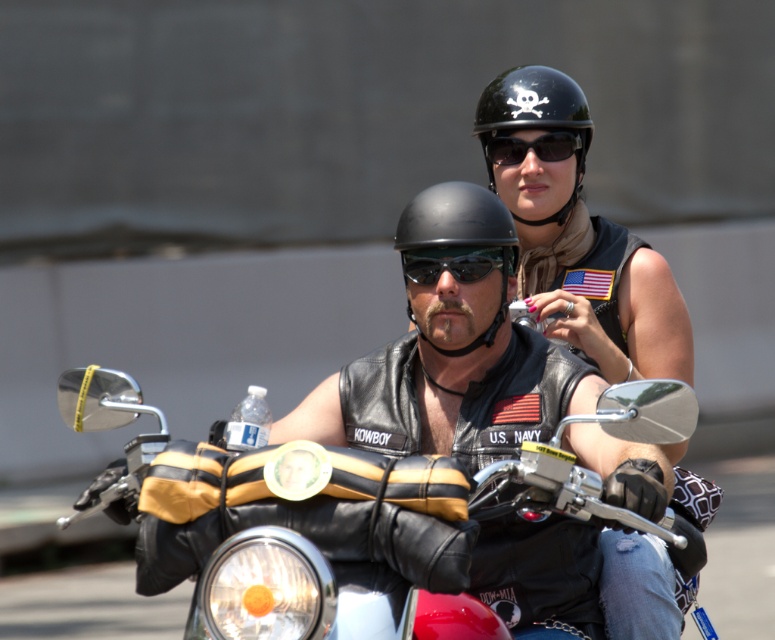
Does black matte helmet at upper center appear on the right side of black matte sunglasses at upper center?

In fact, black matte helmet at upper center is to the left of black matte sunglasses at upper center.

Is black matte helmet at upper center above black matte sunglasses at upper center?

Yes, black matte helmet at upper center is above black matte sunglasses at upper center.

Is point (536, 100) more distant than point (581, 168)?

No, (536, 100) is closer to viewer.

Identify the location of black matte helmet at upper center. (532, 112).

Is point (525, 141) more distant than point (474, 256)?

Yes, point (525, 141) is behind point (474, 256).

From the picture: Does black matte sunglasses at upper center come behind black matte sunglasses at center?

That is True.

Measure the distance between black matte sunglasses at upper center and camera.

They are 10.99 meters apart.

Find the location of a particular element. black matte sunglasses at upper center is located at coordinates (534, 147).

Which of these two, black leather motorcycle at center or black matte sunglasses at center, stands taller?

black leather motorcycle at center

Which is above, black leather motorcycle at center or black matte sunglasses at center?

black matte sunglasses at center is above.

You are a GUI agent. You are given a task and a screenshot of the screen. Output one action in this format:
    pyautogui.click(x=<x>, y=<y>)
    Task: Click on the black leather motorcycle at center
    Image resolution: width=775 pixels, height=640 pixels.
    Given the screenshot: What is the action you would take?
    pyautogui.click(x=419, y=474)